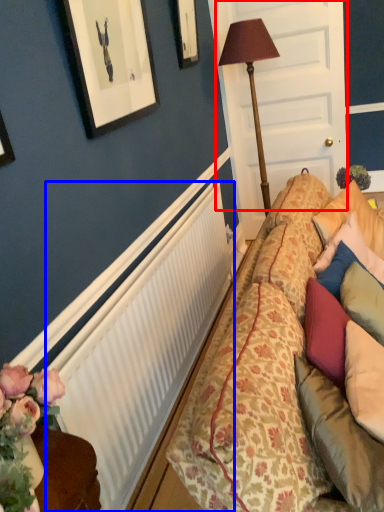
Question: Which object is closer to the camera taking this photo, door (highlighted by a red box) or radiator (highlighted by a blue box)?

Choices:
 (A) door
 (B) radiator

Answer: (B)